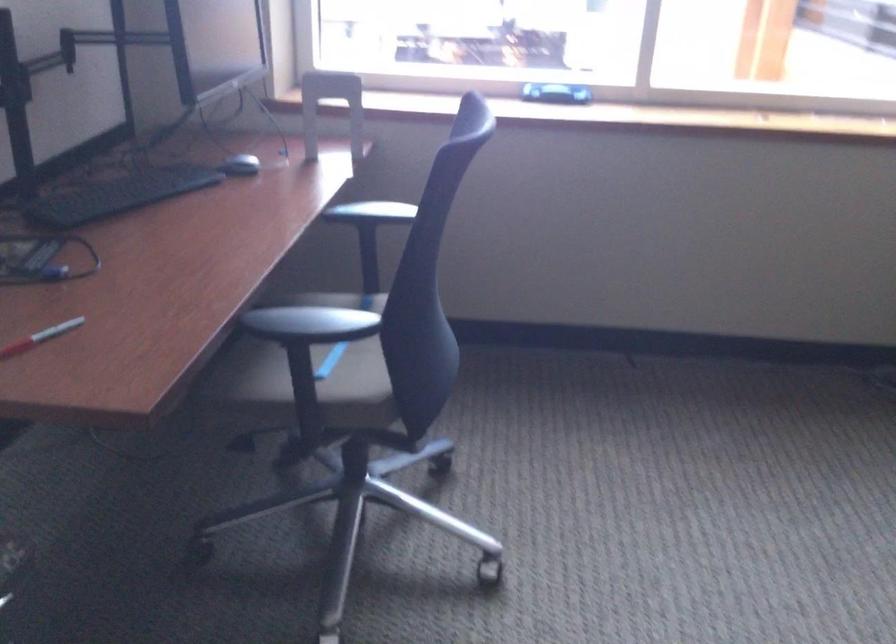
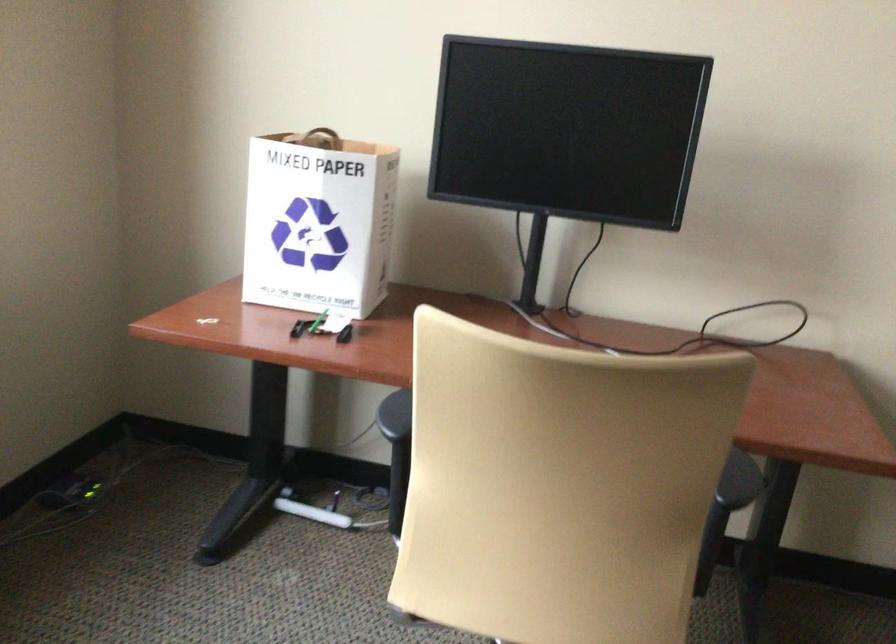
Question: How did the camera likely rotate?

Choices:
 (A) Left
 (B) Right
 (C) Up
 (D) Down

Answer: (B)